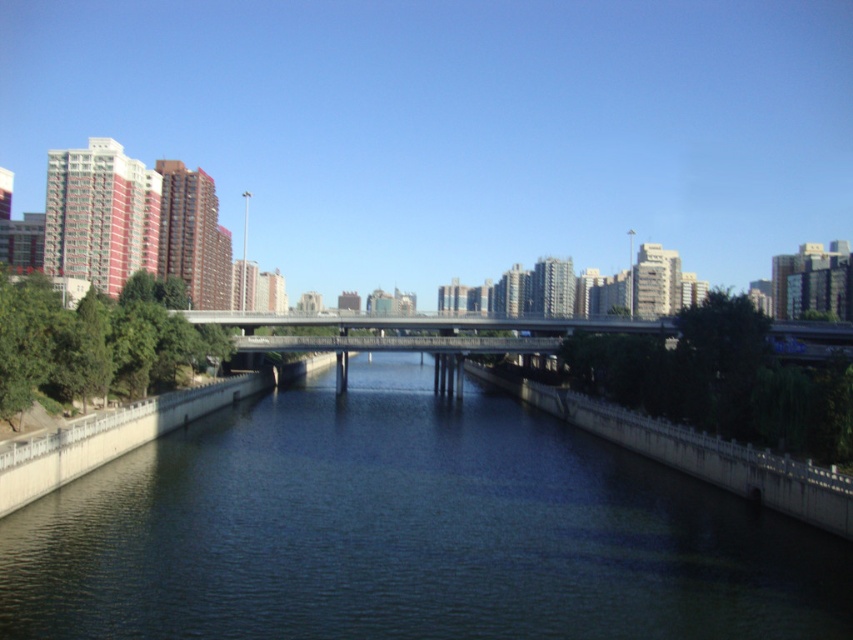
Can you confirm if dark blue concrete river at center is positioned below metallic gray bridge at center?

Correct, dark blue concrete river at center is located below metallic gray bridge at center.

Who is taller, dark blue concrete river at center or metallic gray bridge at center?

metallic gray bridge at center is taller.

You are a GUI agent. You are given a task and a screenshot of the screen. Output one action in this format:
    pyautogui.click(x=<x>, y=<y>)
    Task: Click on the dark blue concrete river at center
    
    Given the screenshot: What is the action you would take?
    pyautogui.click(x=407, y=531)